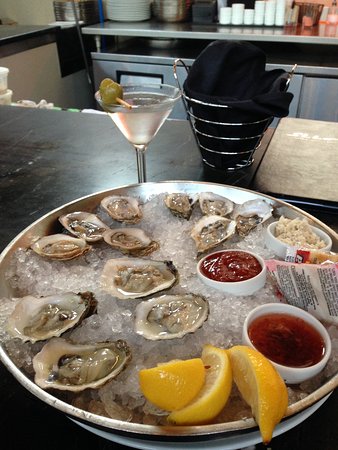
This screenshot has height=450, width=338. Find the location of `metal basket`. metal basket is located at coordinates (196, 100).